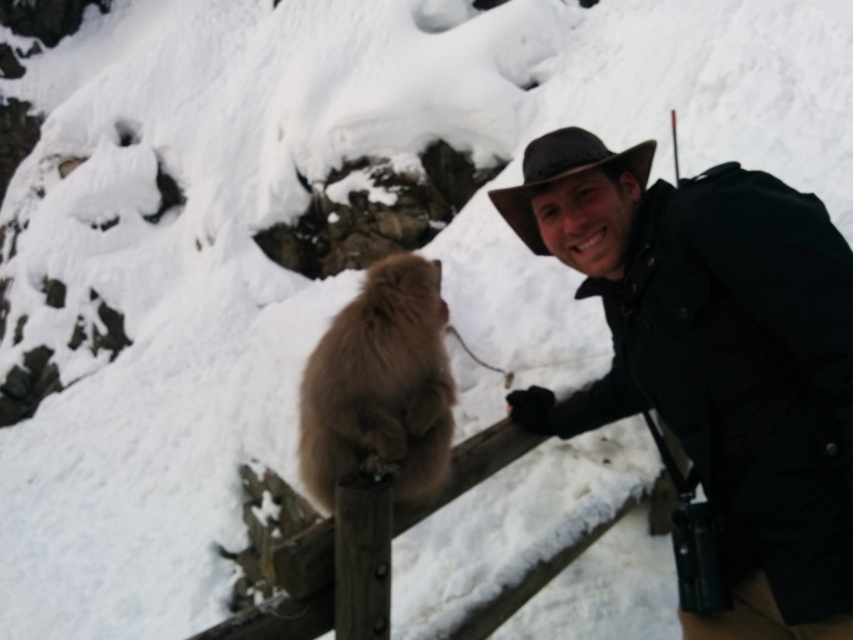
You are standing at the point labeled point [764,556] and want to walk to the point labeled point [538,172]. Which direction should you move in to get closer to your destination?

You should move towards the direction away from the camera because point [538,172] is farther from the camera than point [764,556].

You are standing in the snowy mountain area and want to take a photo of the dark brown leather hat at upper right and the wooden fence at center. Which object should you focus on first if you want both to be in clear focus?

You should focus on the wooden fence at center first because the dark brown leather hat at upper right is closer to the viewer than the wooden fence at center. By focusing on the farther object, you can ensure both are in focus using the depth of field.

You are planning to hang a decorative banner between the wooden fence at center and the fuzzy brown monkey at center. Since the banner needs to be as wide as the wider object, which object determines the minimum width required for the banner?

The fuzzy brown monkey at center is wider than the wooden fence at center, so the banner must be at least as wide as the fuzzy brown monkey at center to fit properly.